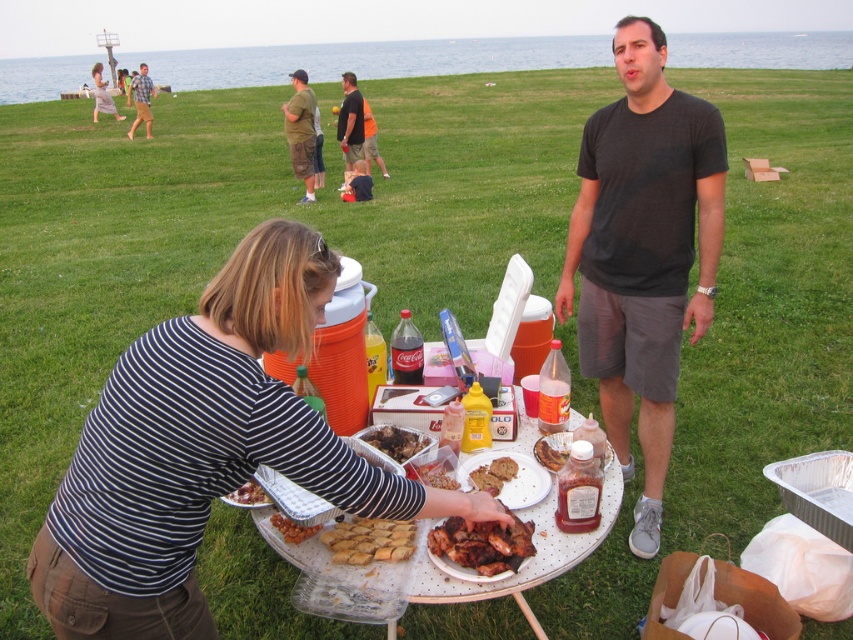
Question: In this image, where is golden crispy pastry at center located relative to brown crumbly bread at center?

Choices:
 (A) right
 (B) left

Answer: (B)

Question: Does brown matte meat at center appear on the right side of golden brown crispy chicken at center?

Choices:
 (A) yes
 (B) no

Answer: (B)

Question: Among these points, which one is nearest to the camera?

Choices:
 (A) (553, 444)
 (B) (434, 467)

Answer: (B)

Question: Which of the following is the closest to the observer?

Choices:
 (A) (451, 484)
 (B) (451, 604)
 (C) (244, 502)
 (D) (485, 483)

Answer: (C)

Question: Which point appears closest to the camera in this image?

Choices:
 (A) (521, 538)
 (B) (143, 76)
 (C) (410, 465)
 (D) (476, 470)

Answer: (A)

Question: Where is chocolate chip cookie at center located in relation to striped fabric shirt at center in the image?

Choices:
 (A) below
 (B) above

Answer: (A)